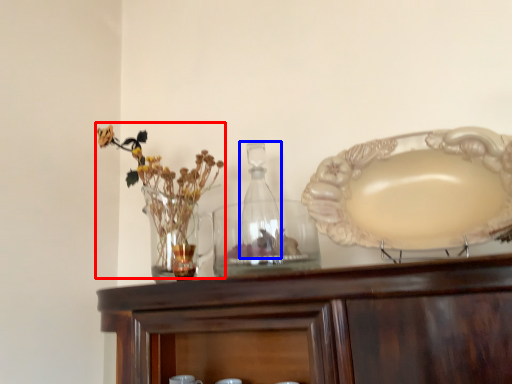
Question: Which point is further to the camera, floral arrangement (highlighted by a red box) or bottle (highlighted by a blue box)?

Choices:
 (A) floral arrangement
 (B) bottle

Answer: (B)